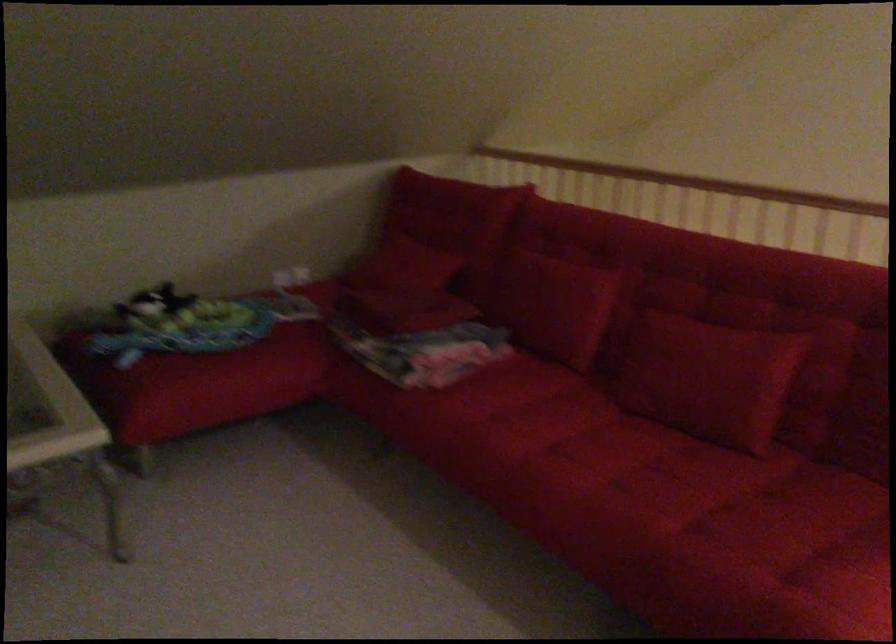
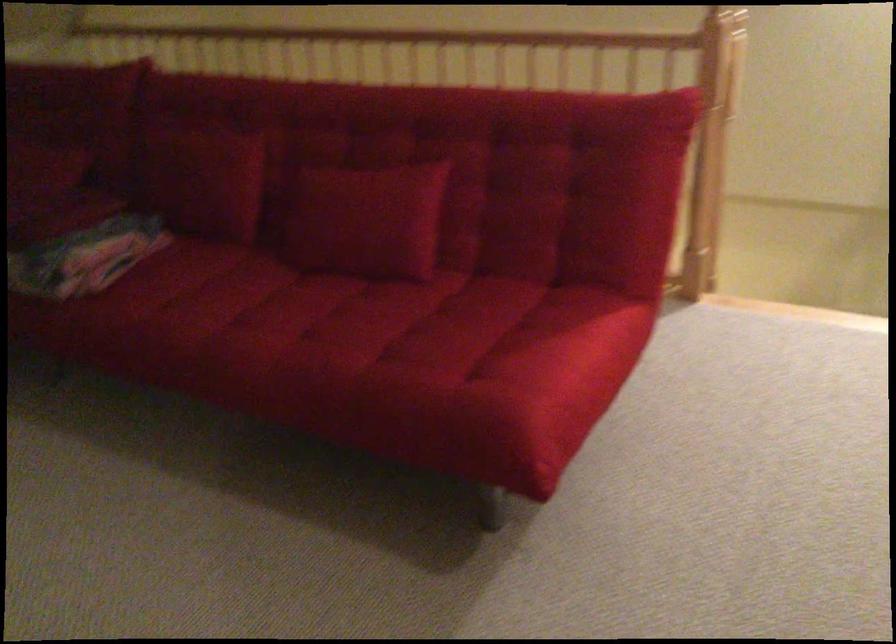
In the second image, find the point that corresponds to the point at 713,375 in the first image.

(366, 220)